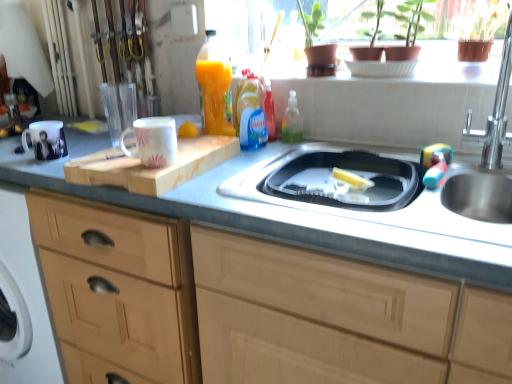
Question: Is point tap(154, 162) closer or farther from the camera than point tap(459, 188)?

Choices:
 (A) closer
 (B) farther

Answer: (A)

Question: From the image's perspective, is white glossy mug at upper center, marked as the first mug in a right-to-left arrangement, above or below stainless steel sink at right, marked as the 1th sink in a top-to-bottom arrangement?

Choices:
 (A) above
 (B) below

Answer: (B)

Question: Which of these objects is positioned closest to the wooden cabinet at left, which is counted as the 1th cabinetry, starting from the right?

Choices:
 (A) wooden cutting board at center
 (B) white glossy mug at upper center, which is the 1th mug from front to back
 (C) blue translucent dish soap at center
 (D) light wood cabinet at left, placed as the 1th cabinetry when sorted from left to right
 (E) white glossy mug at left, which ranks as the 2th mug in right-to-left order

Answer: (D)

Question: Considering the real-world distances, which object is closest to the white glossy mug at left, acting as the 2th mug starting from the front?

Choices:
 (A) wooden cabinet at left, which is counted as the 1th cabinetry, starting from the right
 (B) stainless steel sink at center, which is the second sink from top to bottom
 (C) stainless steel sink at right, which appears as the 2th sink when ordered from the bottom
 (D) white glossy mug at upper center, the second mug when ordered from back to front
 (E) light wood cabinet at left, placed as the 1th cabinetry when sorted from left to right

Answer: (D)